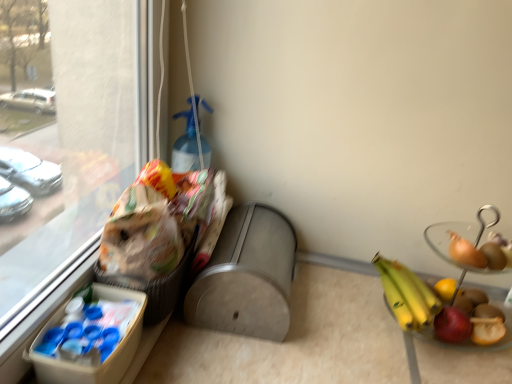
Question: Does point (151, 314) appear closer or farther from the camera than point (120, 329)?

Choices:
 (A) farther
 (B) closer

Answer: (A)

Question: Is plastic woven basket at left in front of or behind white plastic lunch box at lower left in the image?

Choices:
 (A) front
 (B) behind

Answer: (B)

Question: Based on their sizes in the image, would you say plastic woven basket at left is bigger or smaller than white plastic lunch box at lower left?

Choices:
 (A) big
 (B) small

Answer: (A)

Question: In terms of width, does white plastic lunch box at lower left look wider or thinner when compared to plastic woven basket at left?

Choices:
 (A) wide
 (B) thin

Answer: (B)

Question: Is white plastic lunch box at lower left bigger or smaller than plastic woven basket at left?

Choices:
 (A) small
 (B) big

Answer: (A)

Question: From the image's perspective, relative to plastic woven basket at left, is white plastic lunch box at lower left above or below?

Choices:
 (A) below
 (B) above

Answer: (A)

Question: From a real-world perspective, is white plastic lunch box at lower left physically located above or below plastic woven basket at left?

Choices:
 (A) below
 (B) above

Answer: (A)